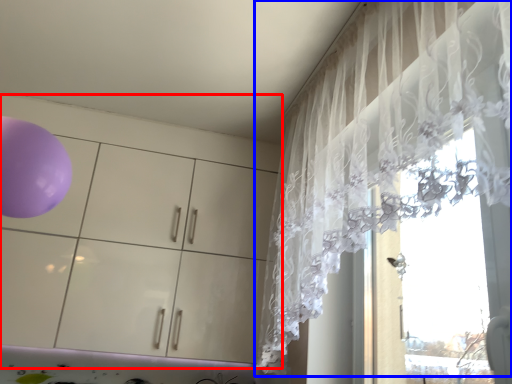
Question: Which point is closer to the camera, dresser (highlighted by a red box) or curtain (highlighted by a blue box)?

Choices:
 (A) dresser
 (B) curtain

Answer: (B)